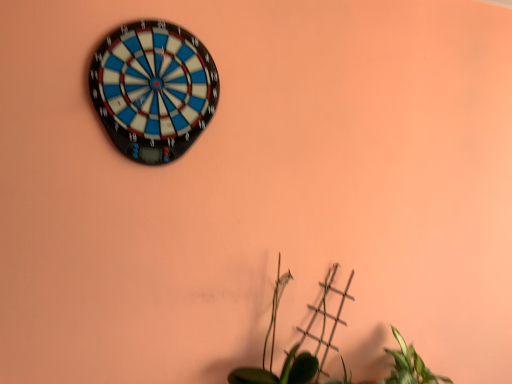
Question: Should I look upward or downward to see blue plastic dartboard at upper left?

Choices:
 (A) down
 (B) up

Answer: (B)

Question: Are green matte plant at lower center and blue plastic dartboard at upper left making contact?

Choices:
 (A) yes
 (B) no

Answer: (B)

Question: Is green matte plant at lower center oriented away from blue plastic dartboard at upper left?

Choices:
 (A) no
 (B) yes

Answer: (A)

Question: Considering the relative positions of green matte plant at lower center and blue plastic dartboard at upper left in the image provided, is green matte plant at lower center behind blue plastic dartboard at upper left?

Choices:
 (A) no
 (B) yes

Answer: (A)

Question: Does green matte plant at lower center turn towards blue plastic dartboard at upper left?

Choices:
 (A) no
 (B) yes

Answer: (A)

Question: Is green matte plant at lower center in front of blue plastic dartboard at upper left?

Choices:
 (A) yes
 (B) no

Answer: (A)

Question: Considering the relative sizes of green matte plant at lower center and blue plastic dartboard at upper left in the image provided, is green matte plant at lower center smaller than blue plastic dartboard at upper left?

Choices:
 (A) yes
 (B) no

Answer: (B)

Question: Would you say blue plastic dartboard at upper left is outside green matte plant at lower center?

Choices:
 (A) no
 (B) yes

Answer: (B)

Question: Can you confirm if blue plastic dartboard at upper left is positioned to the right of green matte plant at lower center?

Choices:
 (A) no
 (B) yes

Answer: (A)

Question: Is blue plastic dartboard at upper left turned away from green matte plant at lower center?

Choices:
 (A) no
 (B) yes

Answer: (A)

Question: From a real-world perspective, is blue plastic dartboard at upper left under green matte plant at lower center?

Choices:
 (A) yes
 (B) no

Answer: (B)

Question: From the image's perspective, is blue plastic dartboard at upper left beneath green matte plant at lower center?

Choices:
 (A) yes
 (B) no

Answer: (B)

Question: Does blue plastic dartboard at upper left lie in front of green matte plant at lower center?

Choices:
 (A) yes
 (B) no

Answer: (B)

Question: From their relative heights in the image, would you say blue plastic dartboard at upper left is taller or shorter than green matte plant at lower center?

Choices:
 (A) short
 (B) tall

Answer: (B)